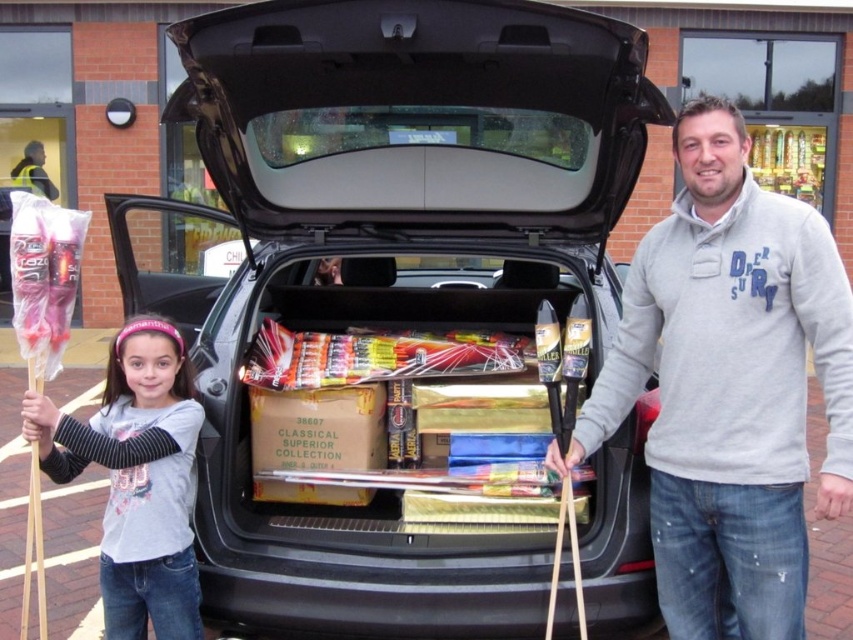
What do you see at coordinates (387, 294) in the screenshot? I see `black matte car trunk at center` at bounding box center [387, 294].

Which is behind, point (483, 468) or point (656, 257)?

The point (483, 468) is more distant.

Which is behind, point (410, 388) or point (801, 387)?

Positioned behind is point (410, 388).

This screenshot has height=640, width=853. What are the coordinates of `black matte car trunk at center` in the screenshot? It's located at (387, 294).

Who is lower down, gray fleece sweater at center or gray cotton shirt at lower left?

gray cotton shirt at lower left is below.

This screenshot has height=640, width=853. I want to click on gray fleece sweater at center, so click(x=729, y=387).

Where is `black matte car trunk at center`? The image size is (853, 640). black matte car trunk at center is located at coordinates (387, 294).

Does point (541, 256) come closer to viewer compared to point (126, 529)?

No, (541, 256) is behind (126, 529).

Find the location of a particular element. black matte car trunk at center is located at coordinates (387, 294).